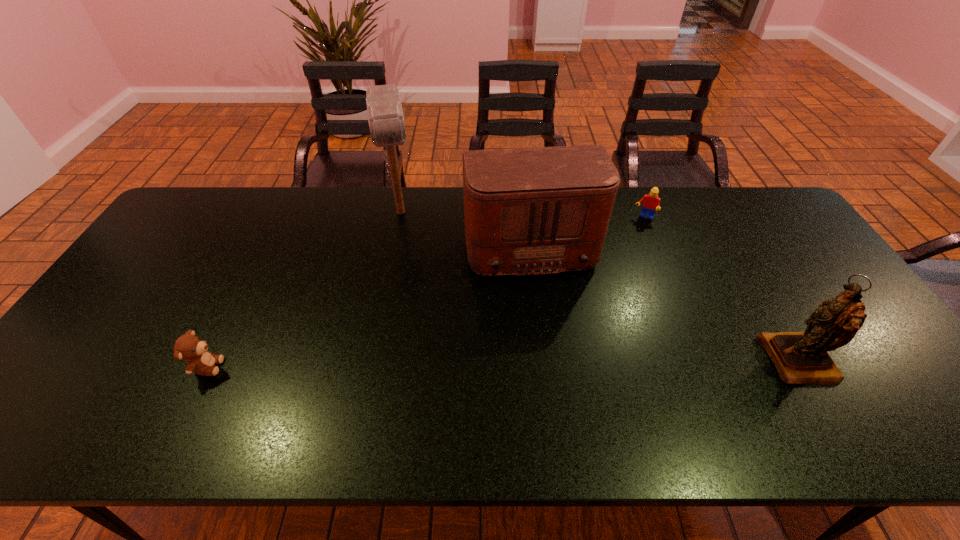
Find the location of a particular element. The height and width of the screenshot is (540, 960). vacant area between the Lego and the teddy bear is located at coordinates (425, 292).

The height and width of the screenshot is (540, 960). In order to click on object that ranks as the fourth closest to the Lego in this screenshot , I will do `click(189, 347)`.

Point out which object is positioned as the nearest to the figurine. Please provide its 2D coordinates. Your answer should be formatted as a tuple, i.e. [(x, y)], where the tuple contains the x and y coordinates of a point satisfying the conditions above.

[(527, 211)]

You are a GUI agent. You are given a task and a screenshot of the screen. Output one action in this format:
    pyautogui.click(x=<x>, y=<y>)
    Task: Click on the vacant position in the image that satisfies the following two spatial constraints: 1. on the front side of the rightmost object; 2. on the front-facing side of the second object from left to right
    Image resolution: width=960 pixels, height=540 pixels.
    Given the screenshot: What is the action you would take?
    pyautogui.click(x=371, y=361)

At what (x,y) coordinates should I click in order to perform the action: click on free space that satisfies the following two spatial constraints: 1. on the back side of the fourth object from left to right; 2. on the left side of the third object from left to right. Please return your answer as a coordinate pair (x, y). The width and height of the screenshot is (960, 540). Looking at the image, I should click on (526, 218).

You are a GUI agent. You are given a task and a screenshot of the screen. Output one action in this format:
    pyautogui.click(x=<x>, y=<y>)
    Task: Click on the vacant point that satisfies the following two spatial constraints: 1. on the front side of the rightmost object; 2. on the front-facing side of the second object from right to left
    The image size is (960, 540).
    Given the screenshot: What is the action you would take?
    pyautogui.click(x=703, y=361)

You are a GUI agent. You are given a task and a screenshot of the screen. Output one action in this format:
    pyautogui.click(x=<x>, y=<y>)
    Task: Click on the free spot that satisfies the following two spatial constraints: 1. on the front side of the rightmost object; 2. on the front-facing side of the mallet
    The height and width of the screenshot is (540, 960).
    Given the screenshot: What is the action you would take?
    pyautogui.click(x=371, y=361)

This screenshot has width=960, height=540. I want to click on vacant area in the image that satisfies the following two spatial constraints: 1. on the back side of the Lego; 2. on the left side of the third object from left to right, so click(x=526, y=218).